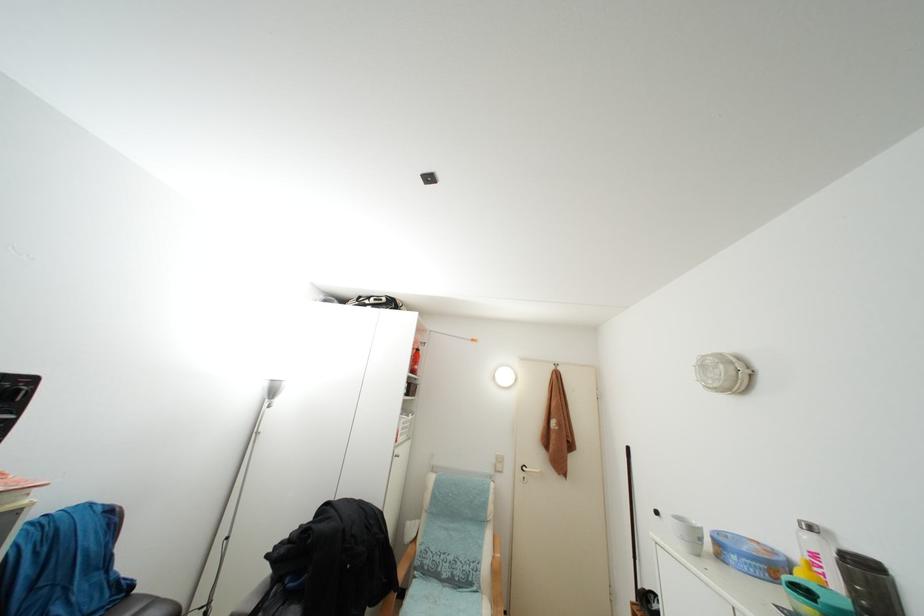
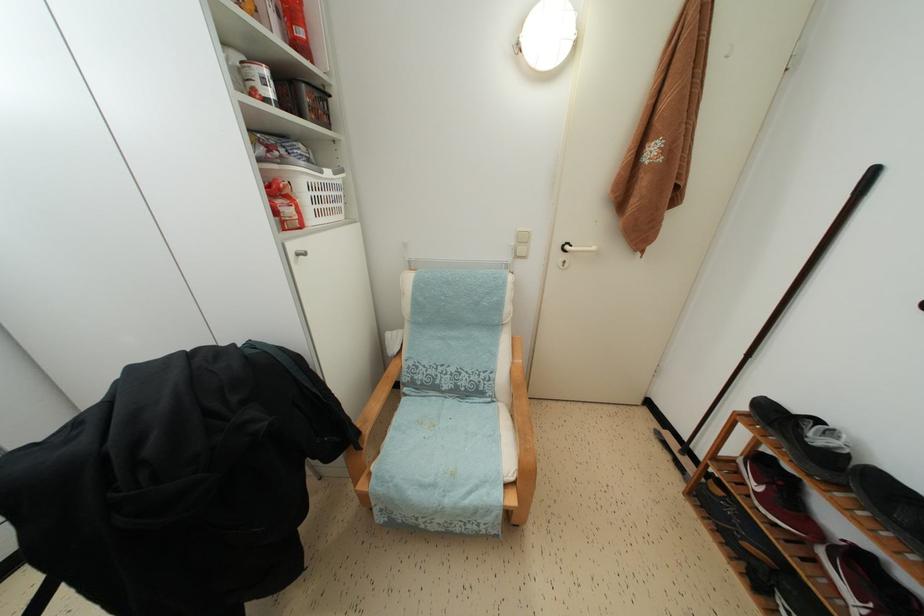
The point at (419, 371) is marked in the first image. Where is the corresponding point in the second image?

(305, 38)